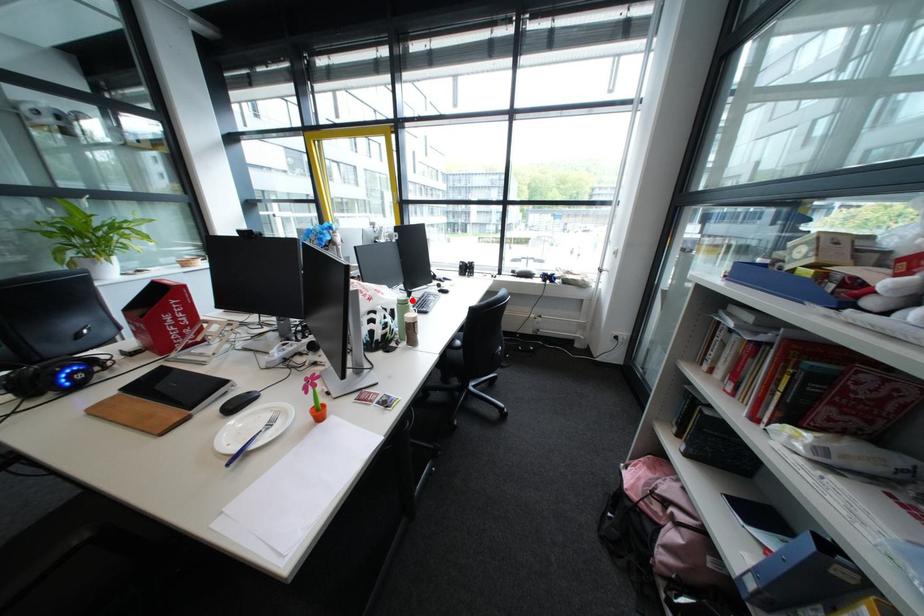
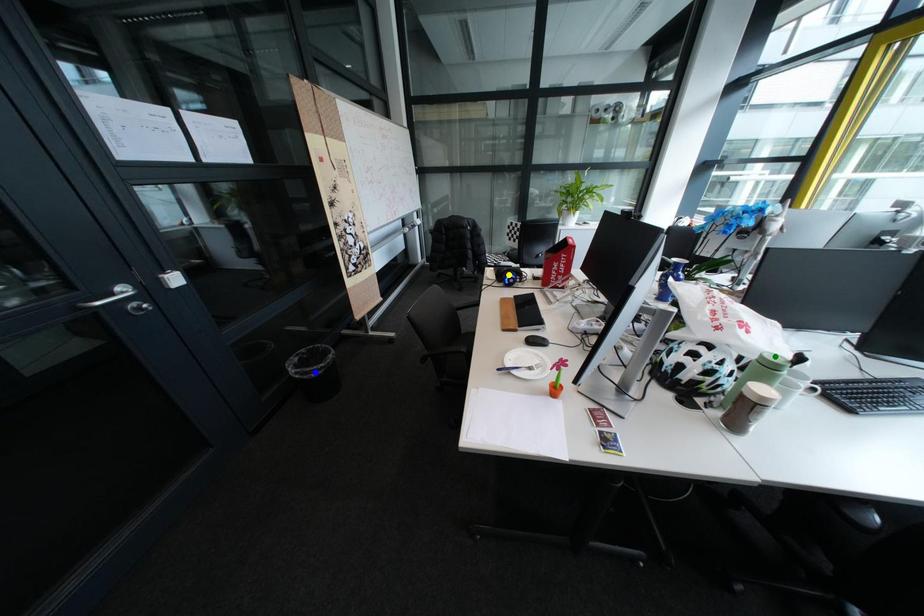
Question: I am providing you with two images of the same scene from different viewpoints. A red point is marked on the first image. You are given multiple points on the second image. Which point in image 2 represents the same 3d spot as the red point in image 1?

Choices:
 (A) green point
 (B) yellow point
 (C) blue point

Answer: (A)